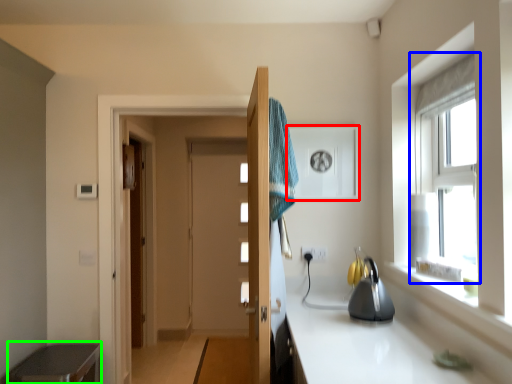
Question: Considering the real-world distances, which object is farthest from medicine cabinet (highlighted by a red box)? window (highlighted by a blue box) or cabinetry (highlighted by a green box)?

Choices:
 (A) window
 (B) cabinetry

Answer: (B)